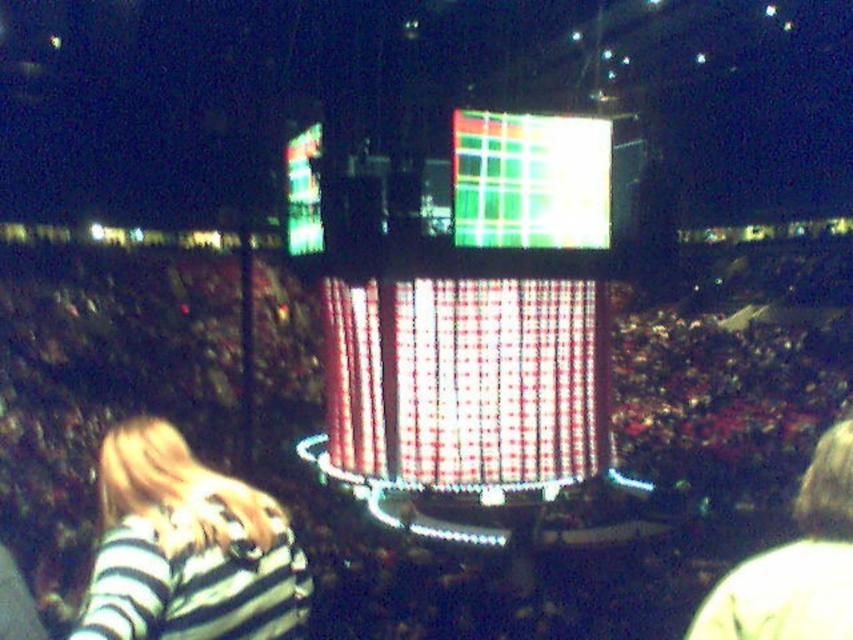
Question: Which point appears farthest from the camera in this image?

Choices:
 (A) (224, 536)
 (B) (520, 241)

Answer: (B)

Question: Can you confirm if black fabric crowd at center is positioned above shiny plastic screen at center?

Choices:
 (A) no
 (B) yes

Answer: (A)

Question: Can you confirm if black fabric crowd at center is smaller than striped fabric shirt at lower left?

Choices:
 (A) no
 (B) yes

Answer: (A)

Question: Can you confirm if black fabric crowd at center is positioned above striped fabric shirt at lower left?

Choices:
 (A) yes
 (B) no

Answer: (A)

Question: Which point is closer to the camera?

Choices:
 (A) (236, 547)
 (B) (572, 129)
 (C) (693, 259)

Answer: (A)

Question: Which of the following is the closest to the observer?

Choices:
 (A) (517, 225)
 (B) (376, 636)
 (C) (164, 557)

Answer: (C)